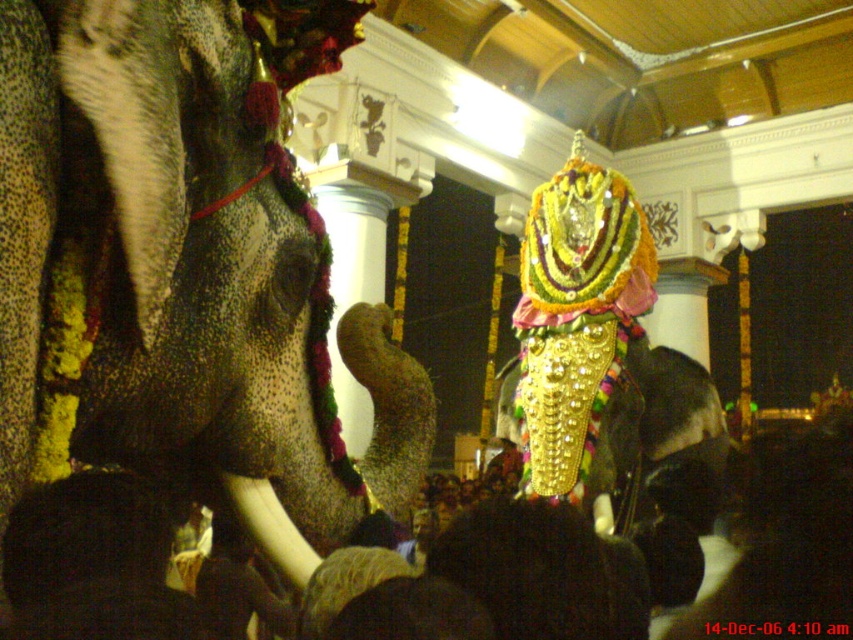
Which is more to the right, dark hair at center or white ivory tusk at lower left?

Positioned to the right is dark hair at center.

Locate an element on the screen. dark hair at center is located at coordinates (787, 544).

Image resolution: width=853 pixels, height=640 pixels. In order to click on dark hair at center in this screenshot , I will do `click(787, 544)`.

The image size is (853, 640). Describe the element at coordinates (660, 440) in the screenshot. I see `gold glittering mask at center` at that location.

Which is in front, point (679, 444) or point (312, 564)?

Point (312, 564) is in front.

The height and width of the screenshot is (640, 853). I want to click on gold glittering mask at center, so click(660, 440).

Which is more to the left, polished gold statue at center or dark hair at center?

Positioned to the left is polished gold statue at center.

Which is below, polished gold statue at center or dark hair at center?

dark hair at center is lower down.

Does point (172, 35) lie behind point (825, 522)?

No.

Where is `polished gold statue at center`? The height and width of the screenshot is (640, 853). polished gold statue at center is located at coordinates (184, 260).